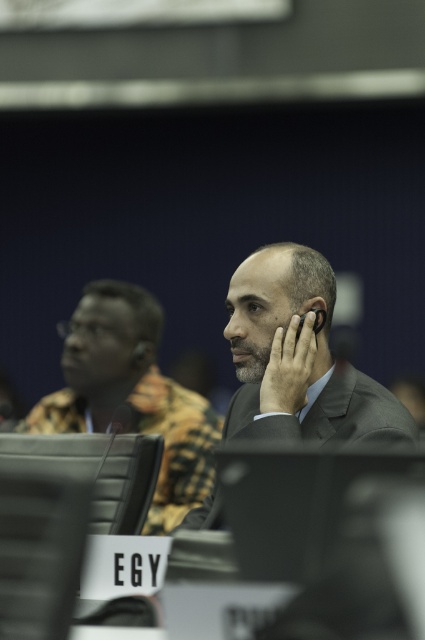
Question: Which point is closer to the camera taking this photo?

Choices:
 (A) (283, 324)
 (B) (156, 410)

Answer: (A)

Question: Observing the image, what is the correct spatial positioning of matte gray suit at center in reference to matte black suit at center?

Choices:
 (A) below
 (B) above

Answer: (B)

Question: Is matte gray suit at center wider than matte black suit at center?

Choices:
 (A) yes
 (B) no

Answer: (B)

Question: Can you confirm if matte gray suit at center is smaller than matte black suit at center?

Choices:
 (A) no
 (B) yes

Answer: (B)